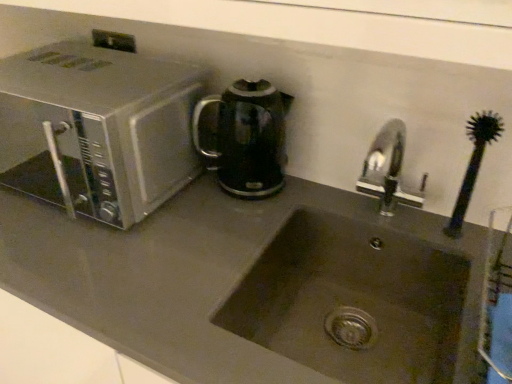
Identify the location of free spot above slate gray stone sink at center (from a real-world perspective). The image size is (512, 384). (169, 231).